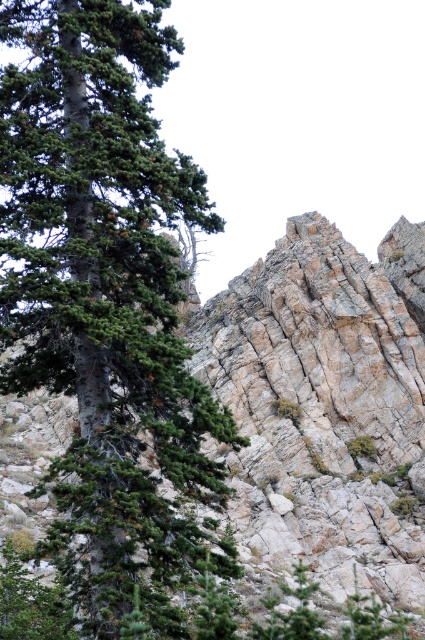
You are standing in front of the rugged stone mountain at center and want to reach the green matte tree at left. Which direction should you move to get closer to the tree?

Since the green matte tree at left is closer to the viewer than the rugged stone mountain at center, you should move backward to get closer to the tree.